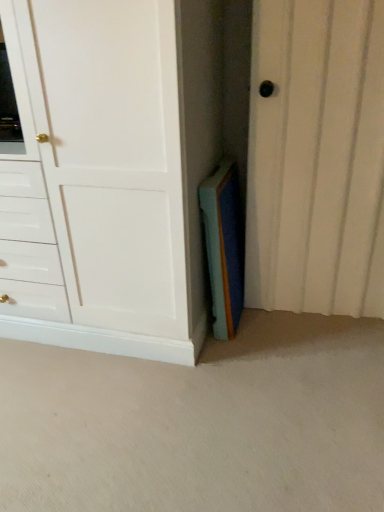
Question: Can you confirm if blue felt book at center is positioned to the right of white matte cabinet at center?

Choices:
 (A) no
 (B) yes

Answer: (B)

Question: Does blue felt book at center have a smaller size compared to white matte cabinet at center?

Choices:
 (A) no
 (B) yes

Answer: (B)

Question: Can you confirm if blue felt book at center is thinner than white matte cabinet at center?

Choices:
 (A) yes
 (B) no

Answer: (A)

Question: Is blue felt book at center to the left of white matte cabinet at center from the viewer's perspective?

Choices:
 (A) yes
 (B) no

Answer: (B)

Question: Does blue felt book at center have a greater height compared to white matte cabinet at center?

Choices:
 (A) yes
 (B) no

Answer: (B)

Question: From a real-world perspective, relative to white matte cabinet at center, is blue felt book at center vertically above or below?

Choices:
 (A) below
 (B) above

Answer: (A)

Question: Considering the relative positions of blue felt book at center and white matte cabinet at center in the image provided, is blue felt book at center to the left or to the right of white matte cabinet at center?

Choices:
 (A) left
 (B) right

Answer: (B)

Question: From the image's perspective, is blue felt book at center above or below white matte cabinet at center?

Choices:
 (A) above
 (B) below

Answer: (B)

Question: Is point (238, 246) closer or farther from the camera than point (107, 81)?

Choices:
 (A) closer
 (B) farther

Answer: (B)

Question: Is point (13, 333) closer or farther from the camera than point (230, 224)?

Choices:
 (A) closer
 (B) farther

Answer: (B)

Question: From the image's perspective, is white matte cabinet at center positioned above or below blue felt book at center?

Choices:
 (A) below
 (B) above

Answer: (B)

Question: From a real-world perspective, is white matte cabinet at center physically located above or below blue felt book at center?

Choices:
 (A) above
 (B) below

Answer: (A)

Question: In terms of width, does white matte cabinet at center look wider or thinner when compared to blue felt book at center?

Choices:
 (A) thin
 (B) wide

Answer: (B)

Question: Considering the positions of point (314, 51) and point (127, 193), is point (314, 51) closer or farther from the camera than point (127, 193)?

Choices:
 (A) closer
 (B) farther

Answer: (B)

Question: From a real-world perspective, relative to white matte cabinet at center, is white textured door at center vertically above or below?

Choices:
 (A) above
 (B) below

Answer: (B)